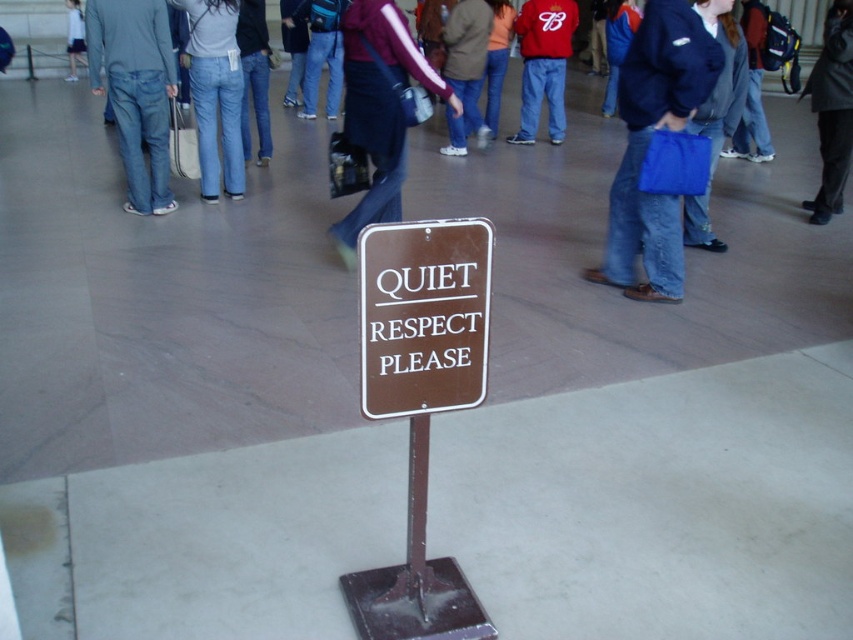
Consider the image. You are standing in the museum and need to locate the brown metal sign at center and the dark gray jacket at center. From your current position, which object is positioned to the right?

The dark gray jacket at center is positioned to the right of the brown metal sign at center.

You are standing in the museum and want to take a photo of the dark gray jacket at center without including the brown metal sign at center in the frame. Is it possible to do so by moving closer to the jacket?

The brown metal sign at center is closer to the viewer than the dark gray jacket at center, so moving closer to the jacket would bring it into the same plane as the sign, making it difficult to exclude the sign from the frame without adjusting the camera angle or zoom.

In the scene shown: You are a visitor standing in the museum. You see the brown metal sign at center and the denim jeans at center. Which object is shorter?

The brown metal sign at center is shorter than the denim jeans at center.